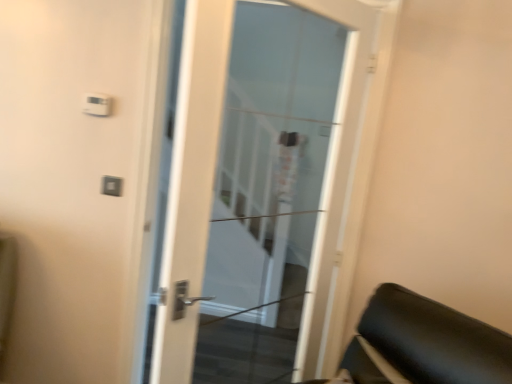
Question: In terms of height, does white glass door at center look taller or shorter compared to matte plastic light switch at upper left?

Choices:
 (A) tall
 (B) short

Answer: (A)

Question: From the image's perspective, is white glass door at center located above or below matte plastic light switch at upper left?

Choices:
 (A) above
 (B) below

Answer: (B)

Question: Is white glass door at center inside the boundaries of matte plastic light switch at upper left, or outside?

Choices:
 (A) inside
 (B) outside

Answer: (B)

Question: Considering the positions of matte plastic light switch at upper left and white glass door at center in the image, is matte plastic light switch at upper left wider or thinner than white glass door at center?

Choices:
 (A) thin
 (B) wide

Answer: (A)

Question: Which is correct: matte plastic light switch at upper left is inside white glass door at center, or outside of it?

Choices:
 (A) inside
 (B) outside

Answer: (B)

Question: From a real-world perspective, is matte plastic light switch at upper left physically located above or below white glass door at center?

Choices:
 (A) below
 (B) above

Answer: (A)

Question: Is point (102, 188) closer or farther from the camera than point (190, 137)?

Choices:
 (A) closer
 (B) farther

Answer: (B)